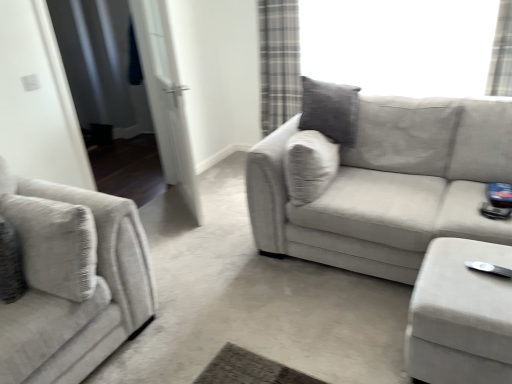
You are a GUI agent. You are given a task and a screenshot of the screen. Output one action in this format:
    pyautogui.click(x=<x>, y=<y>)
    Task: Click on the free space above velvet beige ottoman at lower right (from a real-world perspective)
    The image size is (512, 384).
    Given the screenshot: What is the action you would take?
    pyautogui.click(x=464, y=269)